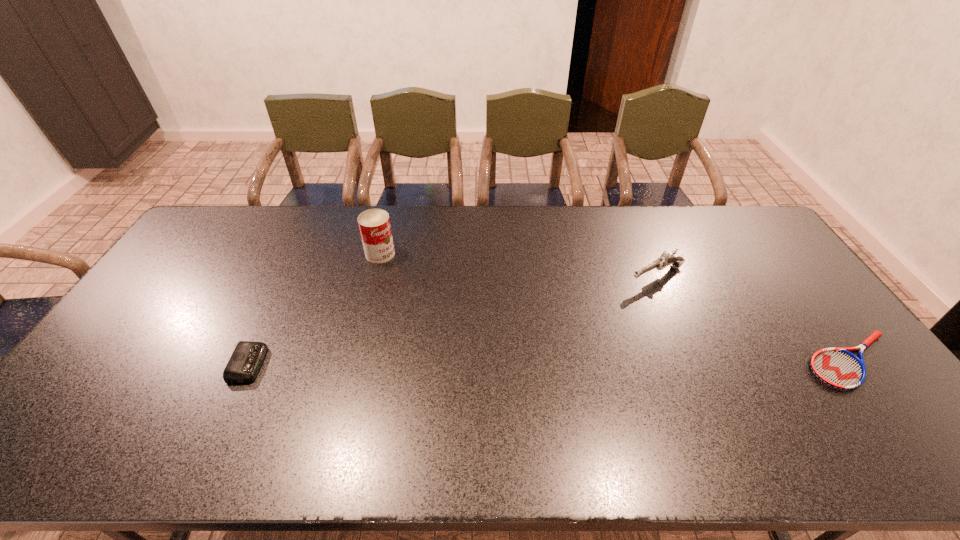
Locate an element on the screen. vacant area at the far edge of the desktop is located at coordinates (640, 225).

The width and height of the screenshot is (960, 540). In the image, there is a desktop. Find the location of `vacant space at the near edge`. vacant space at the near edge is located at coordinates (407, 411).

At what (x,y) coordinates should I click in order to perform the action: click on vacant area at the left edge. Please return your answer as a coordinate pair (x, y). The height and width of the screenshot is (540, 960). Looking at the image, I should click on (213, 270).

Locate an element on the screen. The height and width of the screenshot is (540, 960). vacant region at the right edge of the desktop is located at coordinates (801, 284).

I want to click on free space at the far left corner, so click(239, 217).

Find the location of `free point between the third tallest object and the tennis racket`. free point between the third tallest object and the tennis racket is located at coordinates (550, 362).

This screenshot has height=540, width=960. In order to click on vacant area that lies between the second object from right to left and the tallest object in this screenshot , I will do `click(518, 265)`.

Locate an element on the screen. vacant point located between the tennis racket and the tallest object is located at coordinates 615,307.

At what (x,y) coordinates should I click in order to perform the action: click on free space that is in between the third object from right to left and the alarm clock. Please return your answer as a coordinate pair (x, y). The height and width of the screenshot is (540, 960). Looking at the image, I should click on (315, 309).

Image resolution: width=960 pixels, height=540 pixels. Identify the location of unoccupied area between the shortest object and the gun. (754, 318).